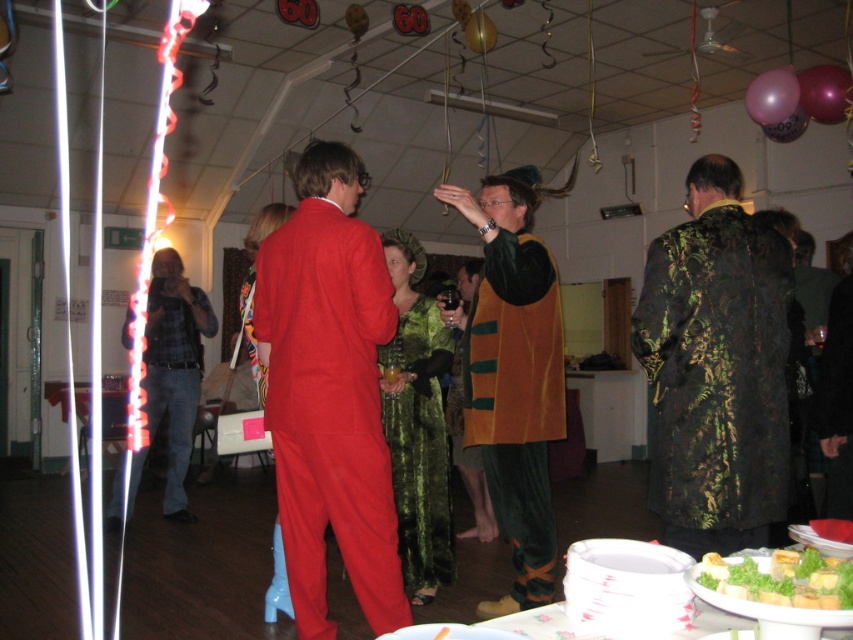
Is the position of matte red suit at center less distant than that of velvet green dress at center?

Yes.

Based on the photo, is matte red suit at center wider than velvet green dress at center?

Correct, the width of matte red suit at center exceeds that of velvet green dress at center.

Between point (320, 544) and point (473, 476), which one is positioned behind?

The point (473, 476) is behind.

Locate an element on the screen. The height and width of the screenshot is (640, 853). matte red suit at center is located at coordinates 329,392.

Is matte red suit at center positioned behind velvet green and orange vest at center?

No.

Who is more forward, (387, 518) or (498, 272)?

Point (387, 518)

Which is in front, point (335, 388) or point (521, 484)?

Point (335, 388)

Identify the location of matte red suit at center. (329, 392).

Is purple glossy balloon at upper right to the left of pink glossy balloon at upper right from the viewer's perspective?

In fact, purple glossy balloon at upper right is to the right of pink glossy balloon at upper right.

Between purple glossy balloon at upper right and pink glossy balloon at upper right, which one is positioned lower?

pink glossy balloon at upper right is lower down.

Describe the element at coordinates (824, 92) in the screenshot. The width and height of the screenshot is (853, 640). I see `purple glossy balloon at upper right` at that location.

In order to click on purple glossy balloon at upper right in this screenshot , I will do `click(824, 92)`.